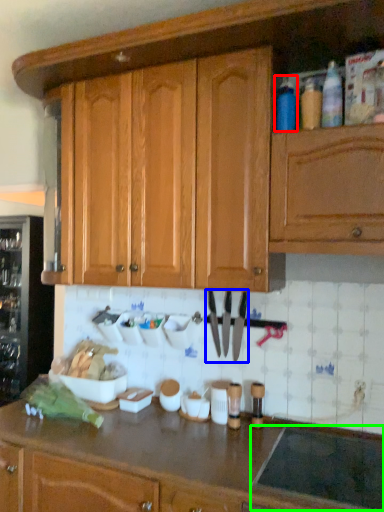
Question: Which object is positioned farthest from bottle (highlighted by a red box)? Select from cutlery (highlighted by a blue box) and appliance (highlighted by a green box).

Choices:
 (A) cutlery
 (B) appliance

Answer: (B)